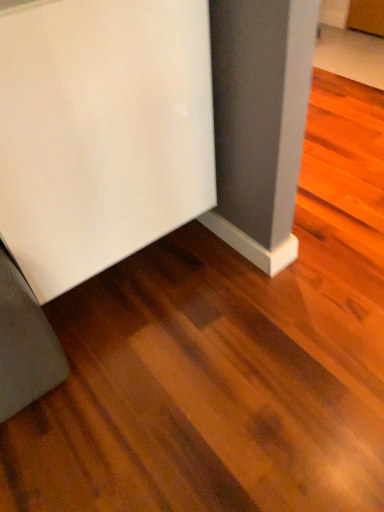
Question: From a real-world perspective, is white glossy refrigerator at lower left, which ranks as the 2th furniture in bottom-to-top order, positioned above or below matte gray baseboard at lower left, positioned as the second furniture in top-to-bottom order?

Choices:
 (A) above
 (B) below

Answer: (A)

Question: In the image, is white glossy refrigerator at lower left, which ranks as the 2th furniture in bottom-to-top order, on the left side or the right side of matte gray baseboard at lower left, positioned as the second furniture in top-to-bottom order?

Choices:
 (A) right
 (B) left

Answer: (A)

Question: In terms of size, does white glossy refrigerator at lower left, the first furniture from the top, appear bigger or smaller than matte gray baseboard at lower left, positioned as the second furniture in top-to-bottom order?

Choices:
 (A) big
 (B) small

Answer: (A)

Question: Considering the positions of point (1, 350) and point (13, 214), is point (1, 350) closer or farther from the camera than point (13, 214)?

Choices:
 (A) farther
 (B) closer

Answer: (A)

Question: In the image, is matte gray baseboard at lower left, which appears as the first furniture when ordered from the bottom, positioned in front of or behind white glossy refrigerator at lower left, the first furniture from the top?

Choices:
 (A) behind
 (B) front

Answer: (A)

Question: From the image's perspective, is matte gray baseboard at lower left, positioned as the second furniture in top-to-bottom order, located above or below white glossy refrigerator at lower left, the first furniture from the top?

Choices:
 (A) below
 (B) above

Answer: (A)

Question: In terms of height, does matte gray baseboard at lower left, positioned as the second furniture in top-to-bottom order, look taller or shorter compared to white glossy refrigerator at lower left, the first furniture from the top?

Choices:
 (A) tall
 (B) short

Answer: (B)